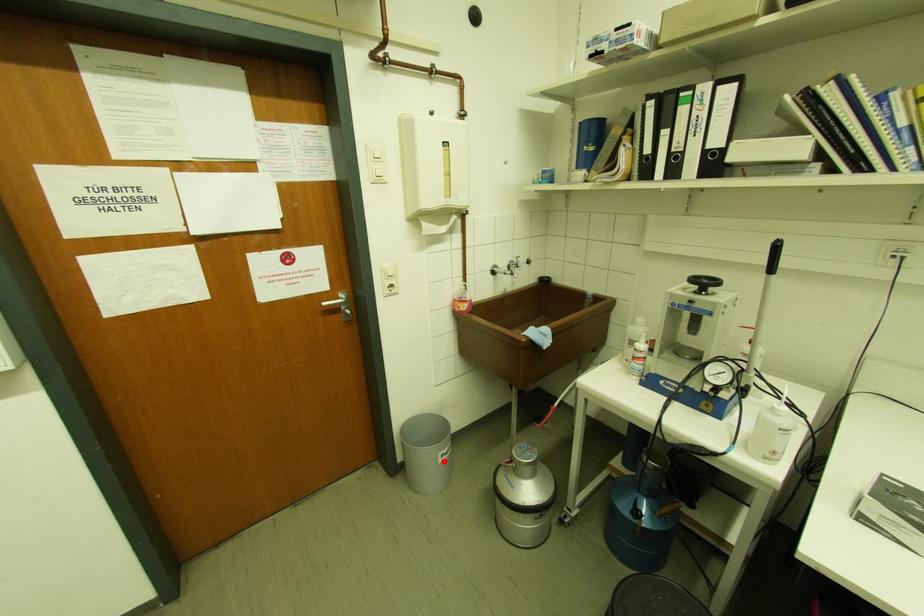
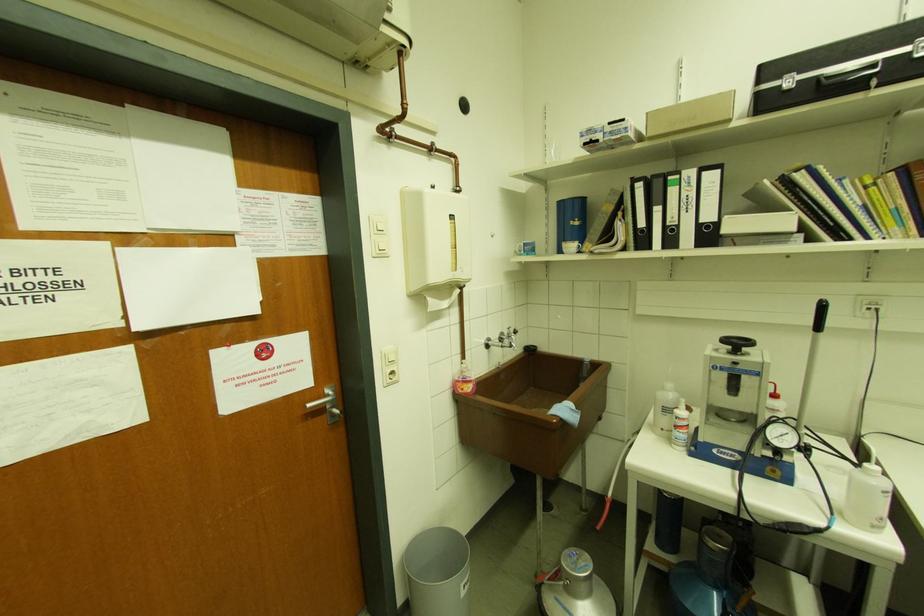
The point at the highlighted location is marked in the first image. Where is the corresponding point in the second image?

(467, 594)